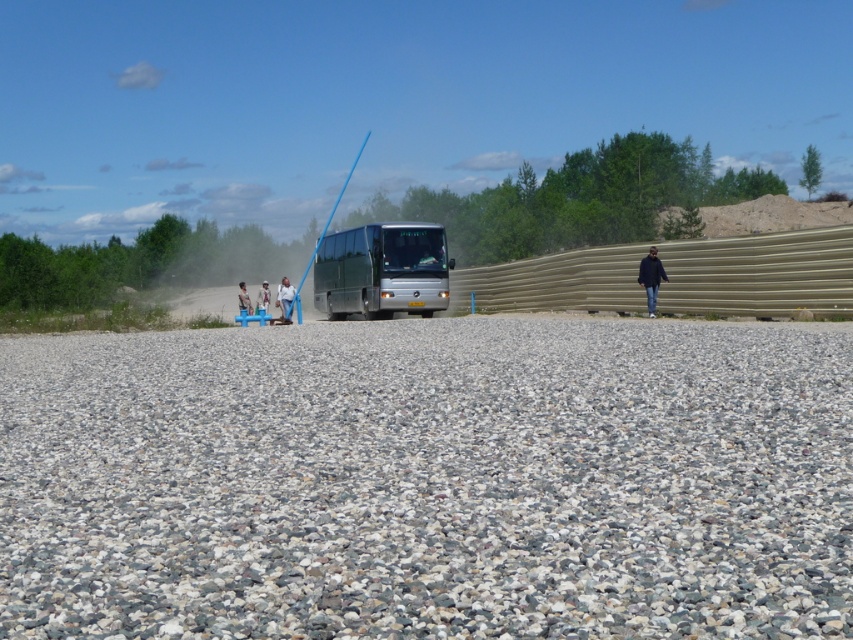
Question: Which of these objects is positioned closest to the camouflage fabric shirt at center?

Choices:
 (A) black matte jacket at center
 (B) light blue fabric pants at center
 (C) light brown leather jacket at center

Answer: (B)

Question: Which of the following is the farthest from the observer?

Choices:
 (A) black matte jacket at center
 (B) gray gravel at center

Answer: (A)

Question: Does silver metallic bus at center have a larger size compared to light blue fabric pants at center?

Choices:
 (A) yes
 (B) no

Answer: (A)

Question: Where is silver metallic bus at center located in relation to light brown leather jacket at center in the image?

Choices:
 (A) below
 (B) above

Answer: (A)

Question: Considering the real-world distances, which object is closest to the silver metallic bus at center?

Choices:
 (A) light brown leather jacket at center
 (B) gray gravel at center
 (C) camouflage fabric shirt at center
 (D) black matte jacket at center

Answer: (C)

Question: Is black matte jacket at center smaller than camouflage fabric shirt at center?

Choices:
 (A) no
 (B) yes

Answer: (B)